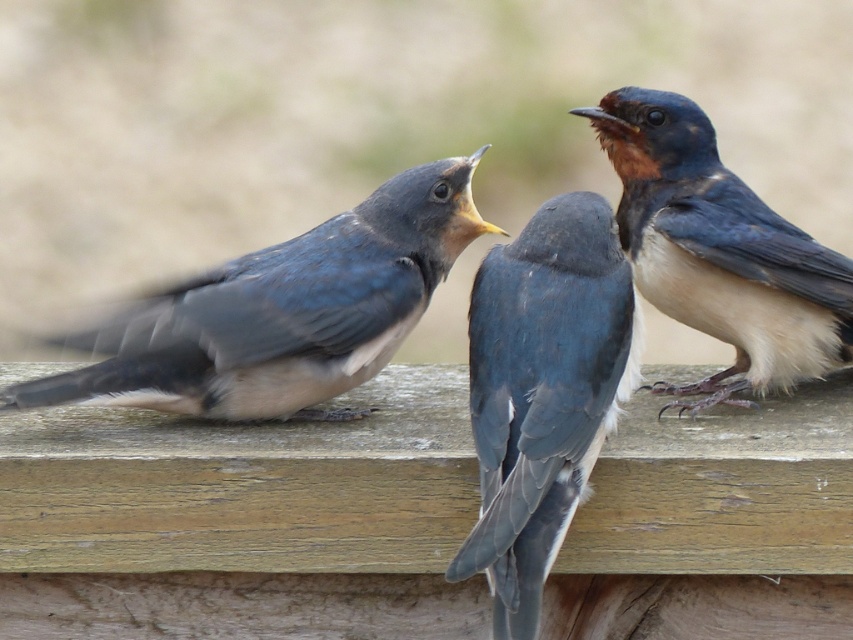
Question: Is blue-gray feathers at left to the left of satin blue feathers at center from the viewer's perspective?

Choices:
 (A) no
 (B) yes

Answer: (B)

Question: Estimate the real-world distances between objects in this image. Which object is farther from the satin blue feathers at center?

Choices:
 (A) blue-gray feathers at center
 (B) blue-gray feathers at left

Answer: (A)

Question: Which point is farther to the camera?

Choices:
 (A) satin blue feathers at center
 (B) blue-gray feathers at center
 (C) blue-gray feathers at left

Answer: (B)

Question: Does blue-gray feathers at left come in front of blue-gray feathers at center?

Choices:
 (A) no
 (B) yes

Answer: (B)

Question: Which of these objects is positioned farthest from the blue-gray feathers at left?

Choices:
 (A) blue-gray feathers at center
 (B) satin blue feathers at center

Answer: (A)

Question: Does satin blue feathers at center come behind blue-gray feathers at center?

Choices:
 (A) yes
 (B) no

Answer: (B)